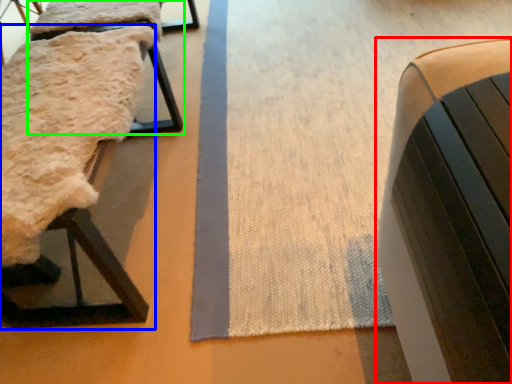
Question: Which object is the closest to the furniture (highlighted by a red box)? Choose among these: furniture (highlighted by a blue box) or furniture (highlighted by a green box).

Choices:
 (A) furniture
 (B) furniture

Answer: (A)